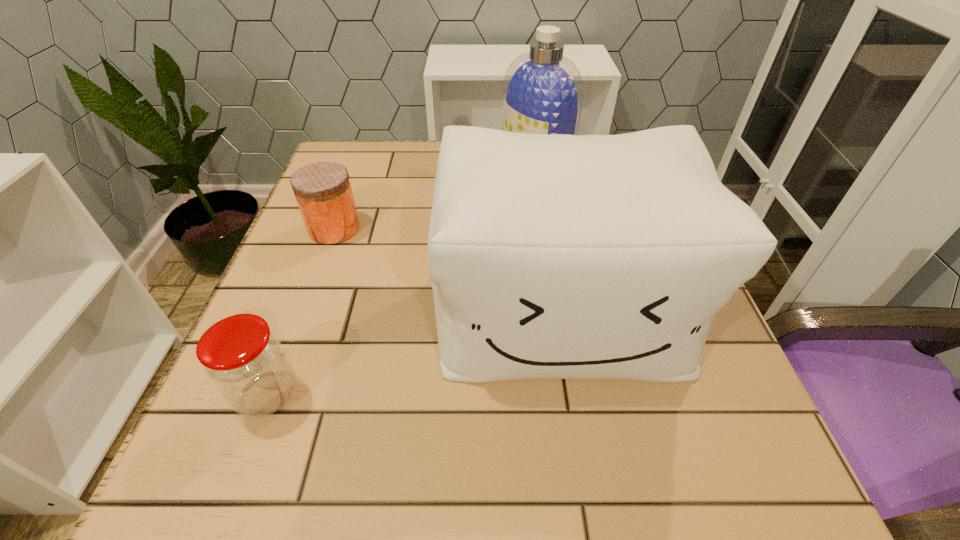
Locate an element on the screen. The width and height of the screenshot is (960, 540). cleansing agent is located at coordinates (543, 92).

I want to click on cushion, so click(559, 256).

At what (x,y) coordinates should I click in order to perform the action: click on the nearer jar. Please return your answer as a coordinate pair (x, y). This screenshot has width=960, height=540. Looking at the image, I should click on (243, 358).

Find the location of `the second farthest object`. the second farthest object is located at coordinates (323, 191).

The width and height of the screenshot is (960, 540). Find the location of `free space located on the left of the cleansing agent`. free space located on the left of the cleansing agent is located at coordinates (443, 165).

Locate an element on the screen. Image resolution: width=960 pixels, height=540 pixels. free spot located 0.120m on the side of the cushion with the smiley face is located at coordinates (588, 475).

Image resolution: width=960 pixels, height=540 pixels. I want to click on free region located 0.130m on the back of the nearer jar, so click(x=302, y=303).

In order to click on free space located on the right of the farther jar in this screenshot , I will do `click(497, 228)`.

You are a GUI agent. You are given a task and a screenshot of the screen. Output one action in this format:
    pyautogui.click(x=<x>, y=<y>)
    Task: Click on the object that is at the far edge
    
    Given the screenshot: What is the action you would take?
    pyautogui.click(x=543, y=92)

Where is `cleansing agent situated at the right edge`? This screenshot has width=960, height=540. cleansing agent situated at the right edge is located at coordinates (543, 92).